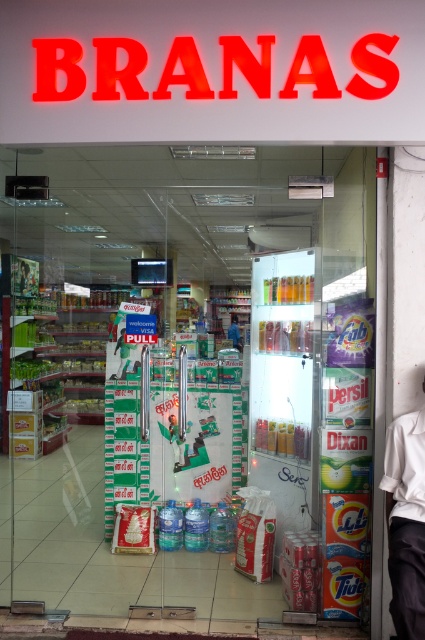
Is white fabric shirt at right shorter than blue fabric shirt at center?

No.

Is point (404, 520) positioned after point (231, 324)?

No, (404, 520) is closer to viewer.

Find the location of a particular element. white fabric shirt at right is located at coordinates (405, 522).

Measure the distance from transparent plastic glass door at center to blue fabric shirt at center.

transparent plastic glass door at center is 6.22 meters away from blue fabric shirt at center.

Who is more distant from viewer, (254,483) or (232,324)?

Positioned behind is point (232,324).

This screenshot has width=425, height=640. I want to click on transparent plastic glass door at center, so click(x=282, y=385).

Which is behind, point (271, 276) or point (401, 595)?

Point (271, 276)

Who is lower down, transparent plastic glass door at center or white fabric shirt at right?

white fabric shirt at right

Between point (289, 310) and point (422, 483), which one is positioned in front?

Point (422, 483) is more forward.

In order to click on transparent plastic glass door at center in this screenshot , I will do `click(282, 385)`.